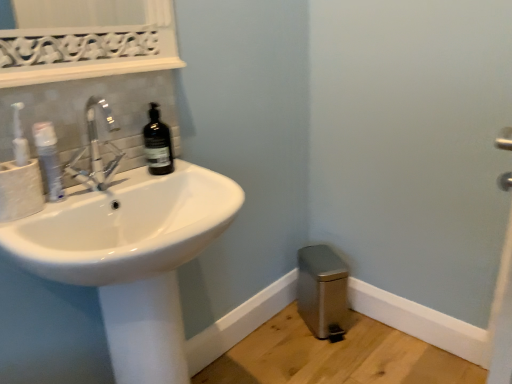
Question: Is matte white toilet paper at left spatially inside black glass bottle at upper left, or outside of it?

Choices:
 (A) outside
 (B) inside

Answer: (A)

Question: Visually, is matte white toilet paper at left positioned to the left or to the right of black glass bottle at upper left?

Choices:
 (A) left
 (B) right

Answer: (A)

Question: Based on their relative distances, which object is nearer to the white glossy sink at left?

Choices:
 (A) satin silver trash can at lower right
 (B) white glossy mouthwash at left
 (C) black glass bottle at upper left
 (D) matte white toilet paper at left

Answer: (C)

Question: Based on their relative distances, which object is farther from the matte white toilet paper at left?

Choices:
 (A) satin silver trash can at lower right
 (B) white glossy sink at left
 (C) white glossy mouthwash at left
 (D) black glass bottle at upper left

Answer: (A)